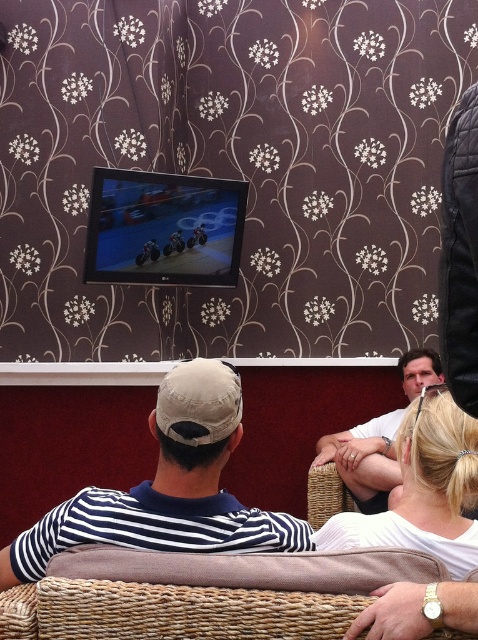
Between striped fabric shirt at center and white matte shirt at lower right, which one has less height?

white matte shirt at lower right

Is striped fabric shirt at center in front of white matte shirt at lower right?

Yes, it is in front of white matte shirt at lower right.

At what (x,y) coordinates should I click in order to perform the action: click on striped fabric shirt at center. Please return your answer as a coordinate pair (x, y). The image size is (478, 640). Looking at the image, I should click on (167, 486).

At what (x,y) coordinates should I click in order to perform the action: click on striped fabric shirt at center. Please return your answer as a coordinate pair (x, y). The width and height of the screenshot is (478, 640). Looking at the image, I should click on (167, 486).

Describe the element at coordinates (423, 490) in the screenshot. I see `white matte shirt at lower right` at that location.

Which of these two, white matte shirt at lower right or white fabric shirt at upper center, stands shorter?

With less height is white matte shirt at lower right.

Where is `white matte shirt at lower right`? The width and height of the screenshot is (478, 640). white matte shirt at lower right is located at coordinates (423, 490).

At what (x,y) coordinates should I click in order to perform the action: click on white matte shirt at lower right. Please return your answer as a coordinate pair (x, y). Looking at the image, I should click on (423, 490).

Is striped fabric shirt at center further to camera compared to white matte baseball cap at center?

Yes, it is.

Between striped fabric shirt at center and white matte baseball cap at center, which one appears on the right side from the viewer's perspective?

From the viewer's perspective, white matte baseball cap at center appears more on the right side.

Locate an element on the screen. This screenshot has width=478, height=640. striped fabric shirt at center is located at coordinates (167, 486).